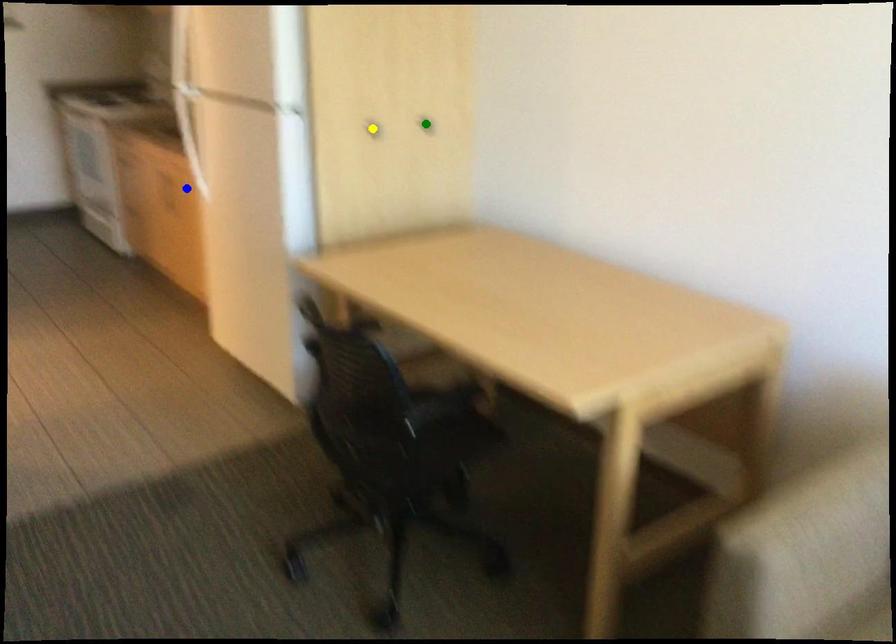
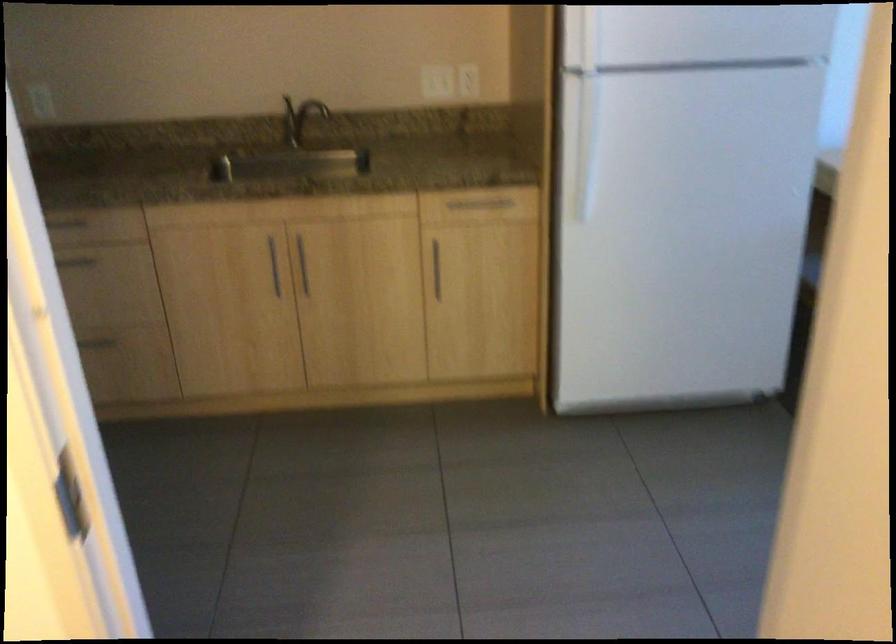
I am providing you with two images of the same scene from different viewpoints. Three points are marked in image1. Which point corresponds to a part or object that is occluded in image2?In image1, three points are marked. Which of them correspond to a part or object that is occluded in image2?Among the three points shown in image1, which one corresponds to a part or object that is no longer visible due to occlusion in image2?

green point, yellow point